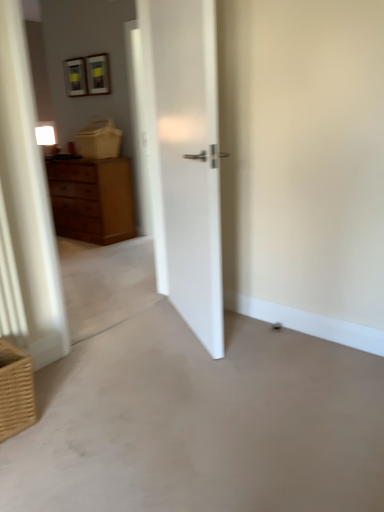
Question: Is the position of brown woven basket at lower left more distant than that of smooth concrete floor at center?

Choices:
 (A) no
 (B) yes

Answer: (B)

Question: From the image's perspective, is brown woven basket at lower left located beneath smooth concrete floor at center?

Choices:
 (A) no
 (B) yes

Answer: (A)

Question: Does brown woven basket at lower left have a greater height compared to smooth concrete floor at center?

Choices:
 (A) yes
 (B) no

Answer: (A)

Question: Is brown woven basket at lower left bigger than smooth concrete floor at center?

Choices:
 (A) no
 (B) yes

Answer: (A)

Question: Is brown woven basket at lower left outside smooth concrete floor at center?

Choices:
 (A) yes
 (B) no

Answer: (A)

Question: Does brown woven basket at lower left have a lesser height compared to smooth concrete floor at center?

Choices:
 (A) yes
 (B) no

Answer: (B)

Question: Is wooden chest of drawers at left not inside smooth concrete floor at center?

Choices:
 (A) yes
 (B) no

Answer: (A)

Question: From a real-world perspective, is wooden chest of drawers at left located beneath smooth concrete floor at center?

Choices:
 (A) no
 (B) yes

Answer: (A)

Question: Is wooden chest of drawers at left beside smooth concrete floor at center?

Choices:
 (A) no
 (B) yes

Answer: (A)

Question: Can smooth concrete floor at center be found inside wooden chest of drawers at left?

Choices:
 (A) no
 (B) yes

Answer: (A)

Question: From the image's perspective, would you say wooden chest of drawers at left is positioned over smooth concrete floor at center?

Choices:
 (A) no
 (B) yes

Answer: (B)

Question: Is wooden chest of drawers at left positioned in front of smooth concrete floor at center?

Choices:
 (A) yes
 (B) no

Answer: (B)

Question: From the image's perspective, is smooth concrete floor at center on top of wooden chest of drawers at left?

Choices:
 (A) yes
 (B) no

Answer: (B)